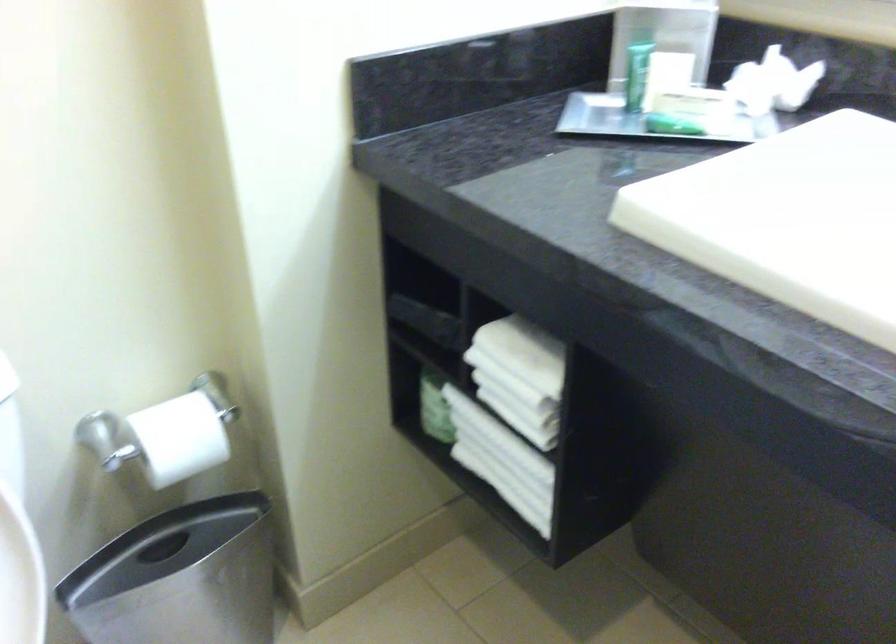
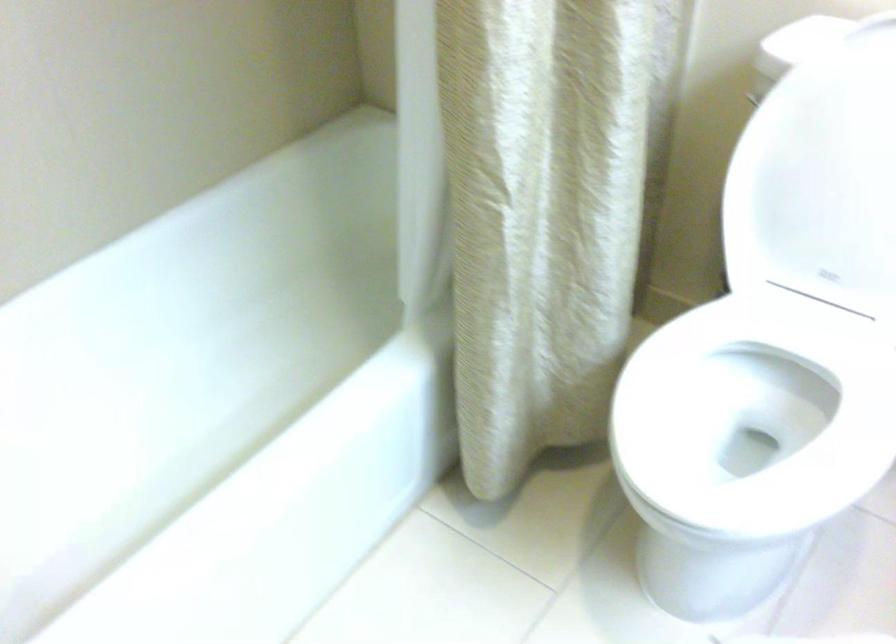
First-person continuous shooting, in which direction is the camera rotating?

The rotation direction of the camera is left-down.